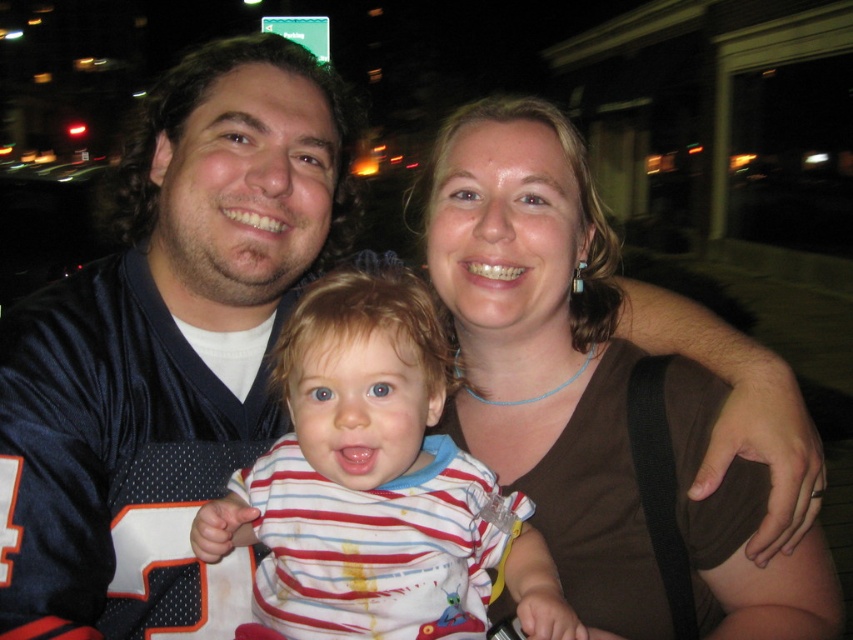
You are a photographer who wants to capture a closeup of the striped cotton shirt at center without including the brown fabric shirt at upper right in the frame. Which direction should you move your camera to achieve this?

You should move your camera to the right to avoid including the brown fabric shirt at upper right in the frame, as it is positioned to the right of the striped cotton shirt at center.